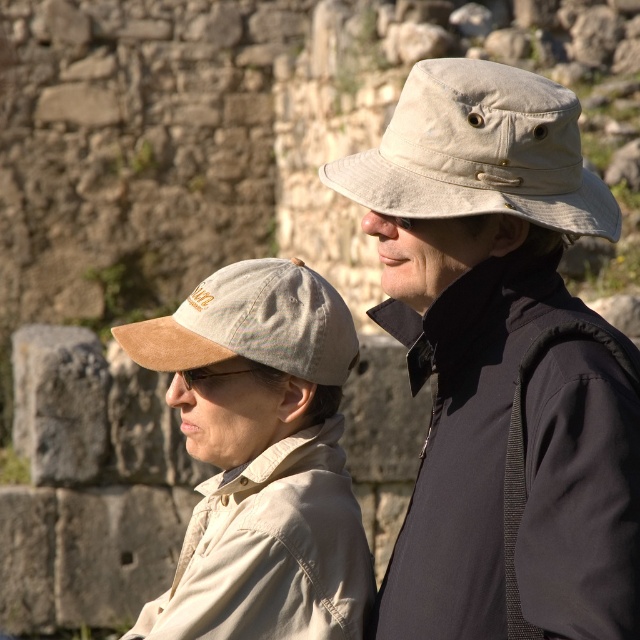
You are an AI analyzing the image. The scene shows two people near a stone wall. Where is the tan suede cap at left located in the image?

The tan suede cap at left is located at the 2D coordinates point [260,458] in the image.

You are a photographer trying to capture both the tan suede cap at left and the tan suede baseball cap at left in a single shot. Which one should you focus on to ensure both are in sharp focus?

You should focus on the tan suede cap at left because it is closer to the viewer, and focusing on the closer object will keep both in focus due to the depth of field.

You are a fashion designer observing two hats in the image. The khaki fabric hat at center and the beige fabric baseball cap at upper center. Which hat is taller?

The khaki fabric hat at center is much taller than the beige fabric baseball cap at upper center.